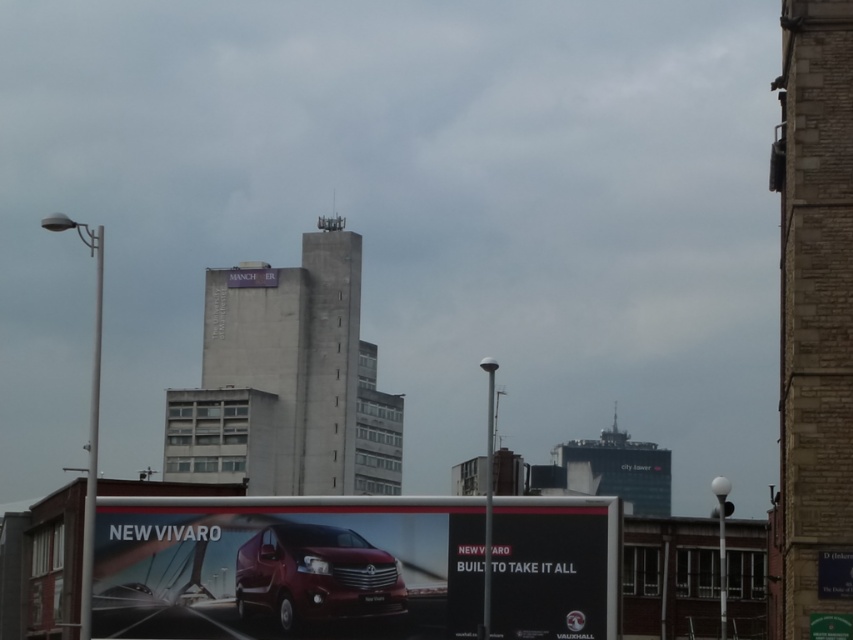
Question: Which point is farther from the camera taking this photo?

Choices:
 (A) (271, 545)
 (B) (279, 326)

Answer: (B)

Question: Is shiny red van at center to the left of concrete building at center from the viewer's perspective?

Choices:
 (A) no
 (B) yes

Answer: (A)

Question: Among these objects, which one is farthest from the camera?

Choices:
 (A) shiny red van at center
 (B) black glossy sign at center

Answer: (B)

Question: Which object appears farthest from the camera in this image?

Choices:
 (A) black glossy sign at center
 (B) glossy metallic van at center
 (C) shiny red van at center

Answer: (B)

Question: Can you confirm if brick textured building at right is bigger than black glossy sign at center?

Choices:
 (A) no
 (B) yes

Answer: (B)

Question: From the image, what is the correct spatial relationship of brick textured building at right in relation to black glossy sign at center?

Choices:
 (A) above
 (B) below

Answer: (A)